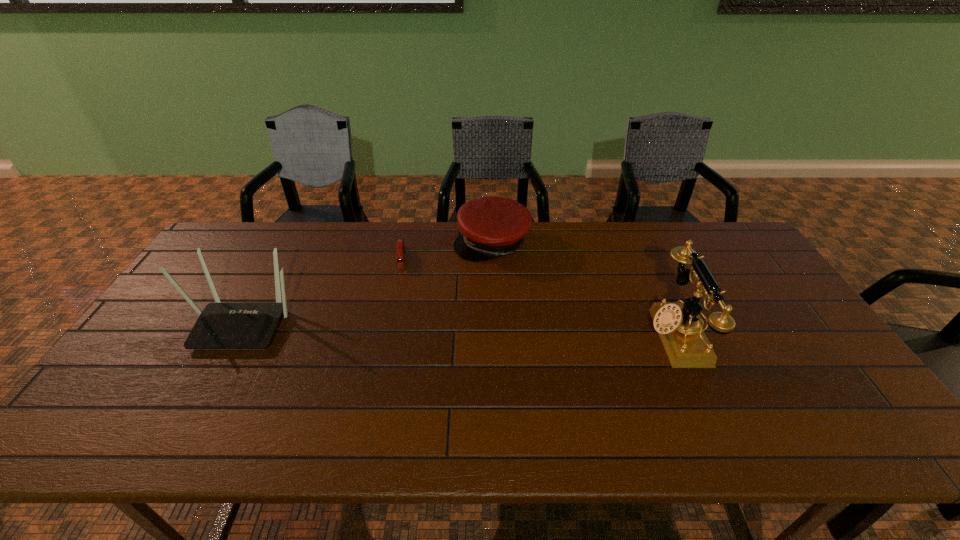
I want to click on vacant region located on the dial of the tallest object, so click(569, 335).

The height and width of the screenshot is (540, 960). I want to click on free location located 0.380m on the dial of the tallest object, so click(x=511, y=335).

At what (x,y) coordinates should I click in order to perform the action: click on blank space located 0.200m on the front-facing side of the second shortest object. Please return your answer as a coordinate pair (x, y). The image size is (960, 540). Looking at the image, I should click on (461, 306).

Find the location of a particular element. The width and height of the screenshot is (960, 540). vacant space situated on the front-facing side of the second shortest object is located at coordinates 473,280.

Find the location of a particular element. The width and height of the screenshot is (960, 540). free space located 0.160m on the front-facing side of the second shortest object is located at coordinates (465, 298).

The image size is (960, 540). What are the coordinates of `vacant space positioned 0.350m on the front-facing side of the shortest object` in the screenshot? It's located at (398, 356).

The image size is (960, 540). Identify the location of vacant space located on the front-facing side of the shortest object. (398, 339).

This screenshot has width=960, height=540. Identify the location of vacant space located on the front-facing side of the shortest object. (399, 280).

Where is `cap that is at the far edge`? cap that is at the far edge is located at coordinates point(491,227).

At what (x,y) coordinates should I click in order to perform the action: click on stapler at the far edge. Please return your answer as a coordinate pair (x, y). This screenshot has height=540, width=960. Looking at the image, I should click on (400, 242).